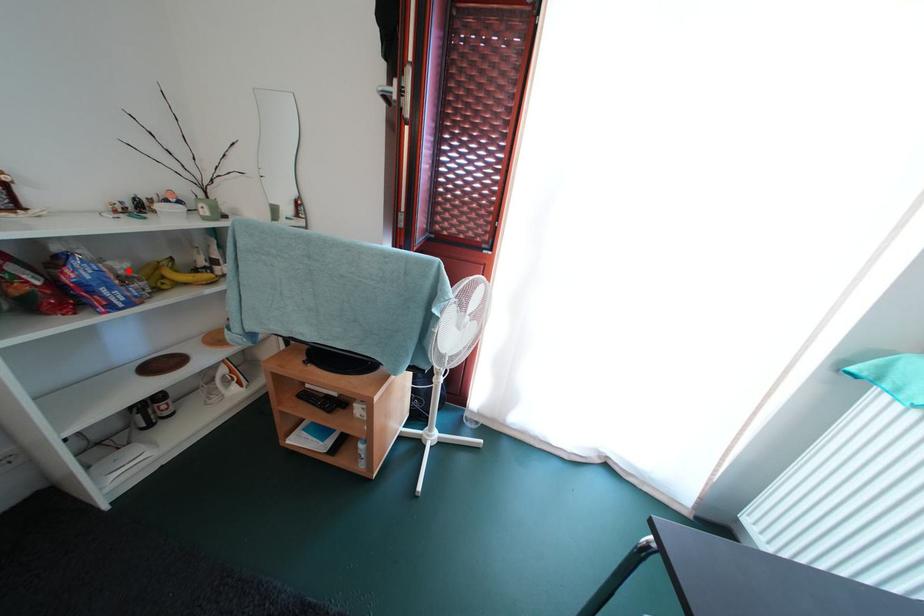
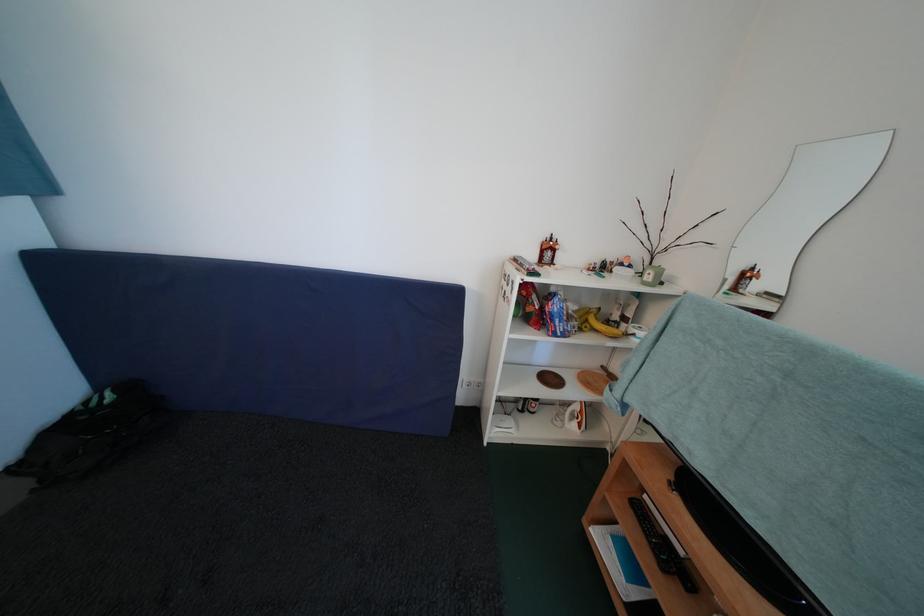
The point at the highlighted location is marked in the first image. Where is the corresponding point in the second image?

(579, 313)